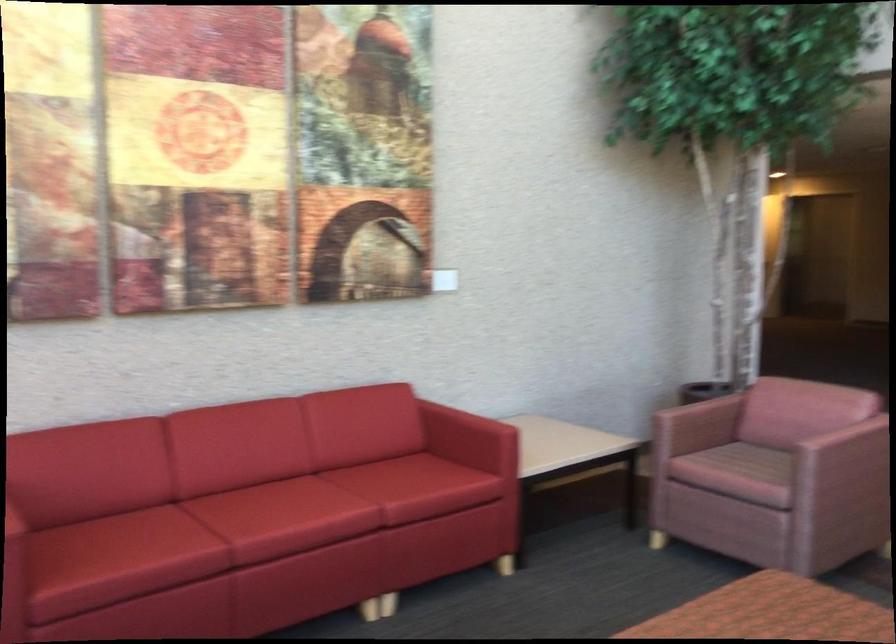
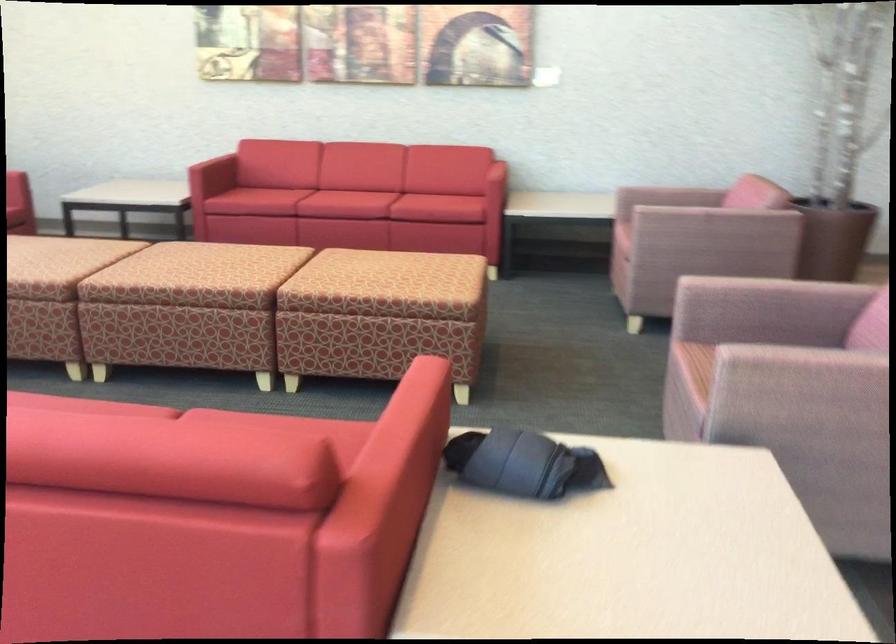
Find the pixel in the second image that matches point 717,467 in the first image.

(624, 218)